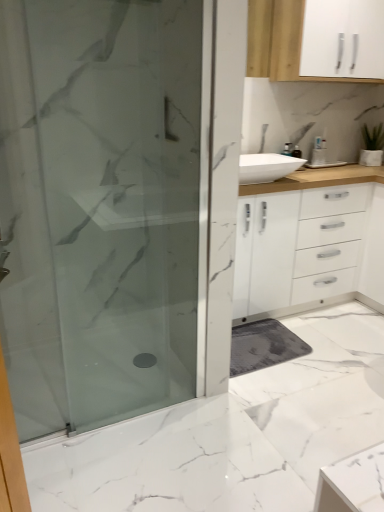
Question: Does point (288, 9) appear closer or farther from the camera than point (142, 390)?

Choices:
 (A) farther
 (B) closer

Answer: (A)

Question: Is white matte cabinet at upper right in front of or behind frosted glass shower door at left in the image?

Choices:
 (A) front
 (B) behind

Answer: (B)

Question: Is white matte cabinet at upper right taller or shorter than frosted glass shower door at left?

Choices:
 (A) tall
 (B) short

Answer: (B)

Question: Considering the positions of frosted glass shower door at left and white matte cabinet at upper right in the image, is frosted glass shower door at left wider or thinner than white matte cabinet at upper right?

Choices:
 (A) thin
 (B) wide

Answer: (A)

Question: Is frosted glass shower door at left in front of or behind white matte cabinet at upper right in the image?

Choices:
 (A) behind
 (B) front

Answer: (B)

Question: Visually, is frosted glass shower door at left positioned to the left or to the right of white matte cabinet at upper right?

Choices:
 (A) left
 (B) right

Answer: (A)

Question: Is frosted glass shower door at left situated inside white matte cabinet at upper right or outside?

Choices:
 (A) inside
 (B) outside

Answer: (B)